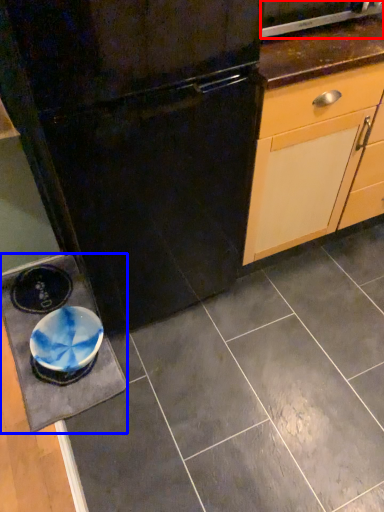
Question: Among these objects, which one is nearest to the camera, home appliance (highlighted by a red box) or slate (highlighted by a blue box)?

Choices:
 (A) home appliance
 (B) slate

Answer: (A)